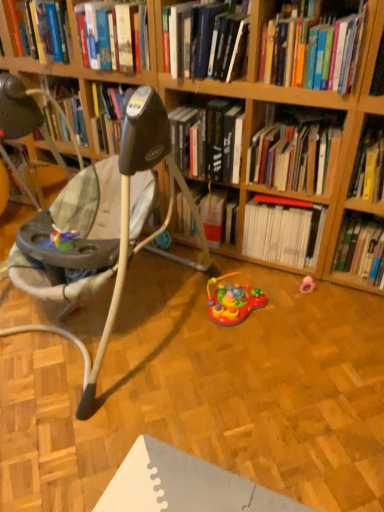
Question: Considering the relative positions of yellow paper at upper right, which is the 7th book from left to right, and beige fabric baby swing at left in the image provided, is yellow paper at upper right, which is the 7th book from left to right, in front of beige fabric baby swing at left?

Choices:
 (A) yes
 (B) no

Answer: (B)

Question: Can you confirm if yellow paper at upper right, which is the second book from right to left, is positioned to the left of beige fabric baby swing at left?

Choices:
 (A) yes
 (B) no

Answer: (B)

Question: Does yellow paper at upper right, which is the 7th book from left to right, lie behind beige fabric baby swing at left?

Choices:
 (A) yes
 (B) no

Answer: (A)

Question: Does yellow paper at upper right, which is the 7th book from left to right, turn towards beige fabric baby swing at left?

Choices:
 (A) yes
 (B) no

Answer: (B)

Question: Is yellow paper at upper right, which is the 7th book from left to right, thinner than beige fabric baby swing at left?

Choices:
 (A) yes
 (B) no

Answer: (A)

Question: Is hardcover book at center, which is counted as the fifth book, starting from the left, in front of or behind wooden bookshelf at upper center in the image?

Choices:
 (A) behind
 (B) front

Answer: (B)

Question: Is point (297, 129) positioned closer to the camera than point (94, 12)?

Choices:
 (A) farther
 (B) closer

Answer: (A)

Question: Do you think hardcover book at center, which is counted as the fifth book, starting from the left, is within wooden bookshelf at upper center, or outside of it?

Choices:
 (A) inside
 (B) outside

Answer: (B)

Question: Is hardcover book at center, which is counted as the fifth book, starting from the left, bigger or smaller than wooden bookshelf at upper center?

Choices:
 (A) small
 (B) big

Answer: (A)

Question: Looking at their shapes, would you say pink rubber pacifier at lower right, the second toy from the left, is wider or thinner than multicolored plastic toy at center, marked as the second toy in a right-to-left arrangement?

Choices:
 (A) wide
 (B) thin

Answer: (B)

Question: From the image's perspective, relative to multicolored plastic toy at center, the 1th toy viewed from the left, is pink rubber pacifier at lower right, which is the first toy from right to left, above or below?

Choices:
 (A) above
 (B) below

Answer: (A)

Question: Would you say pink rubber pacifier at lower right, the second toy from the left, is inside or outside multicolored plastic toy at center, the 1th toy viewed from the left?

Choices:
 (A) inside
 (B) outside

Answer: (B)

Question: Looking at the image, does pink rubber pacifier at lower right, which is the first toy from right to left, seem bigger or smaller compared to multicolored plastic toy at center, the 1th toy viewed from the left?

Choices:
 (A) big
 (B) small

Answer: (B)

Question: From the image's perspective, is hardcover book at upper center, the 7th book positioned from the right, located above or below hardcover book at upper center, the 8th book positioned from the right?

Choices:
 (A) below
 (B) above

Answer: (A)

Question: Is hardcover book at upper center, the 7th book positioned from the right, taller or shorter than hardcover book at upper center, the 8th book positioned from the right?

Choices:
 (A) short
 (B) tall

Answer: (B)